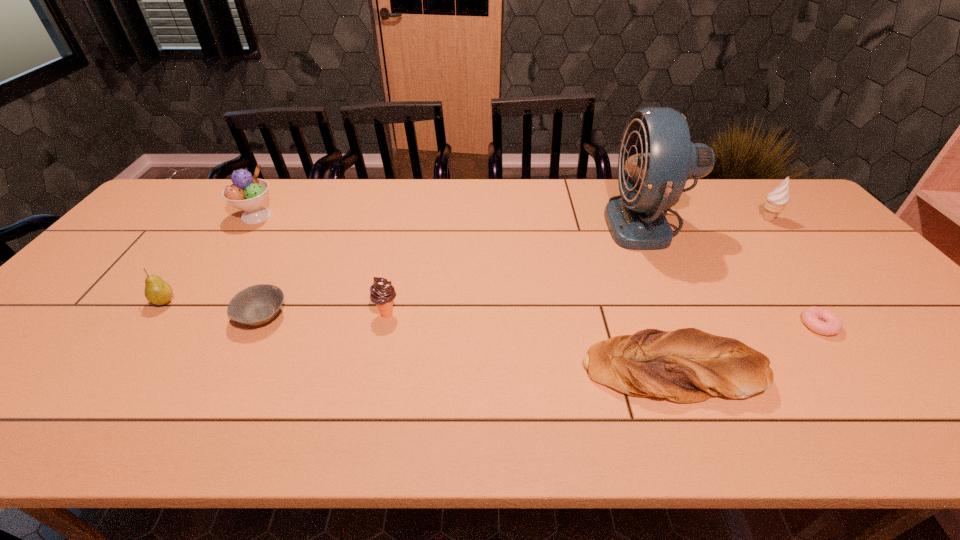
Where is `the seventh object from left to right`? the seventh object from left to right is located at coordinates (831, 324).

The image size is (960, 540). In order to click on free space located 0.290m in front of the fan to blow air in this screenshot , I will do `click(515, 224)`.

Locate an element on the screen. The width and height of the screenshot is (960, 540). vacant space located in front of the fan to blow air is located at coordinates (527, 224).

Find the location of a particular element. The height and width of the screenshot is (540, 960). vacant space situated 0.370m in front of the fan to blow air is located at coordinates (489, 224).

In order to click on free spot located on the right of the leftmost icecream in this screenshot , I will do `click(293, 217)`.

This screenshot has width=960, height=540. What are the coordinates of `free region located 0.150m on the front-facing side of the rightmost icecream` in the screenshot? It's located at (710, 219).

Identify the location of free region located 0.270m on the front-facing side of the rightmost icecream. (673, 219).

Image resolution: width=960 pixels, height=540 pixels. I want to click on free point located on the front-facing side of the rightmost icecream, so click(702, 219).

At what (x,y) coordinates should I click in order to perform the action: click on free space located on the back of the nearest icecream. Please return your answer as a coordinate pair (x, y). Looking at the image, I should click on (402, 241).

The height and width of the screenshot is (540, 960). Identify the location of vacant space situated 0.130m on the left of the pear. (102, 302).